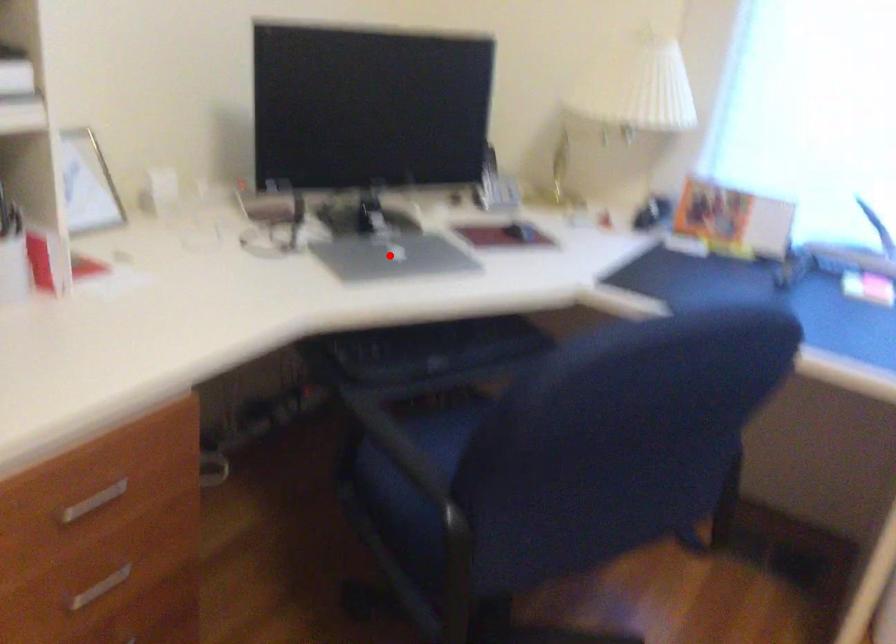
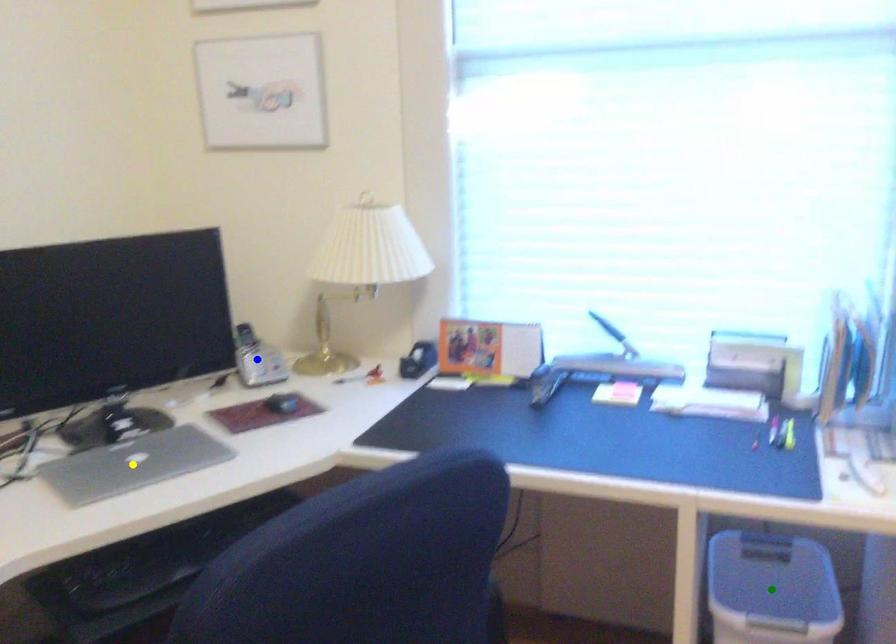
Question: I am providing you with two images of the same scene from different viewpoints. A red point is marked on the first image. You are given multiple points on the second image. Which point in image 2 represents the same 3d spot as the red point in image 1?

Choices:
 (A) green point
 (B) yellow point
 (C) blue point

Answer: (B)